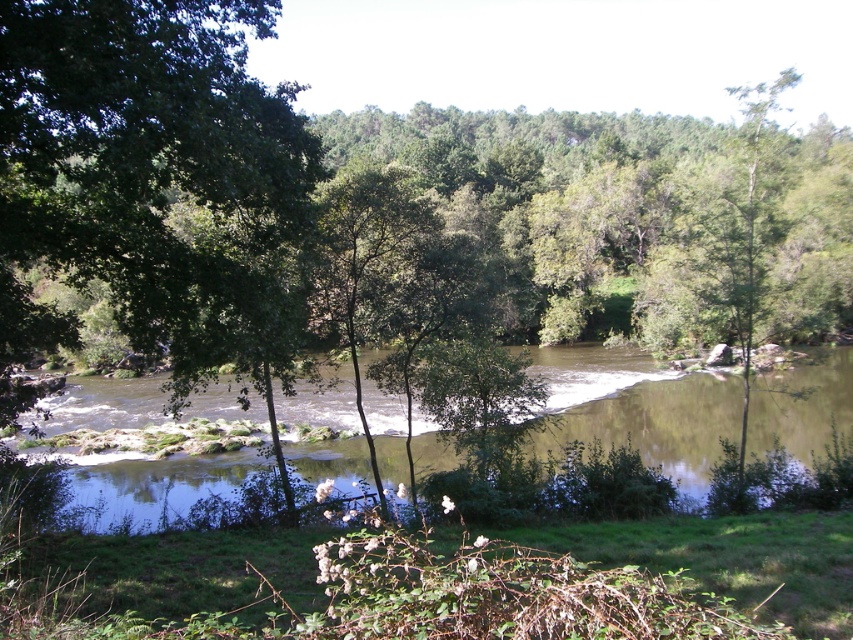
Question: Among these points, which one is nearest to the camera?

Choices:
 (A) (740, 225)
 (B) (772, 410)

Answer: (A)

Question: In this image, where is brown smooth river at center located relative to green leafy tree at upper right?

Choices:
 (A) below
 (B) above

Answer: (A)

Question: Which of the following is the farthest from the observer?

Choices:
 (A) (744, 305)
 (B) (421, 468)

Answer: (B)

Question: Considering the relative positions of brown smooth river at center and green leafy tree at upper right in the image provided, where is brown smooth river at center located with respect to green leafy tree at upper right?

Choices:
 (A) right
 (B) left

Answer: (B)

Question: Can you confirm if brown smooth river at center is positioned to the left of green leafy tree at upper right?

Choices:
 (A) no
 (B) yes

Answer: (B)